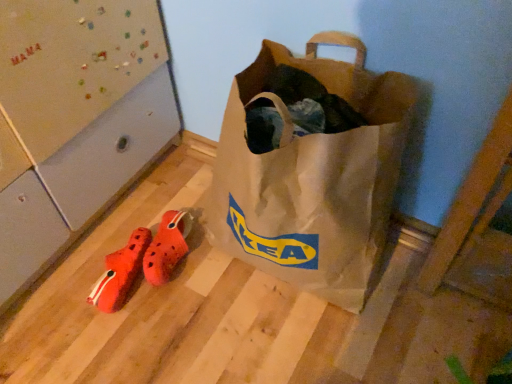
The height and width of the screenshot is (384, 512). In order to click on vacant space to the right of orange fabric shoe at lower left in this screenshot , I will do `click(201, 291)`.